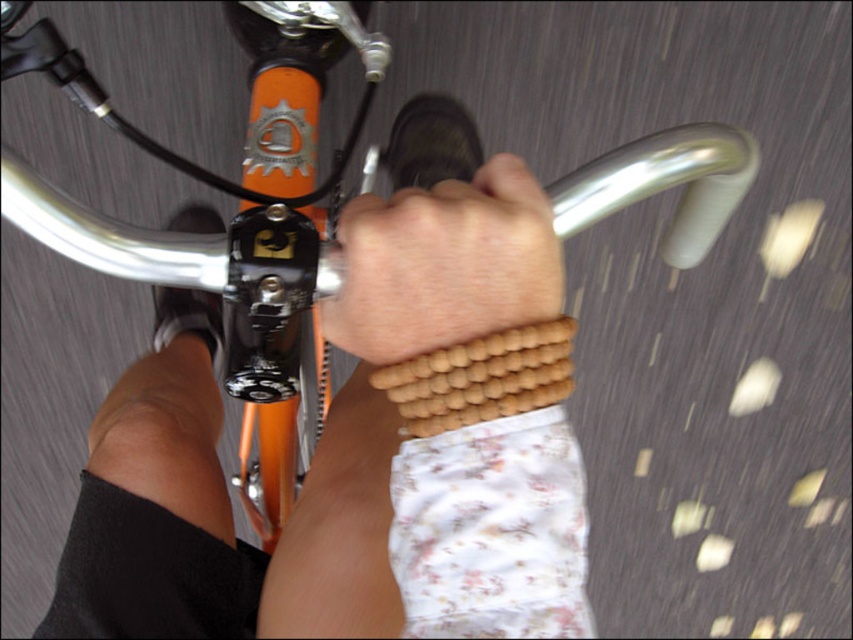
You are a cyclist riding a bike and need to check the distance between your handlebars and the wooden beads at center. Can you reach them without moving your hands?

The wooden beads at center are 11.72 inches away from camera, so if the cyclist can extend their hands 11.72 inches forward from their current position, they can reach them without moving their hands.